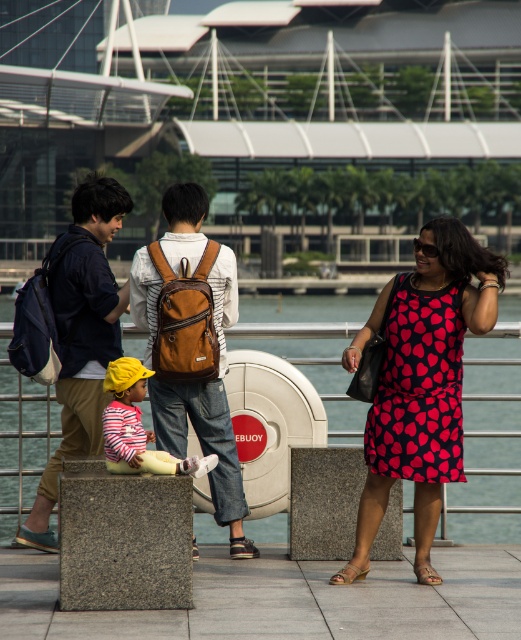
Question: Is printed fabric dress at center above brown leather backpack at center?

Choices:
 (A) no
 (B) yes

Answer: (B)

Question: Which point appears farthest from the camera in this image?

Choices:
 (A) (387, 467)
 (B) (111, 340)

Answer: (B)

Question: Does clear blue water at center appear on the left side of brown leather backpack at center?

Choices:
 (A) yes
 (B) no

Answer: (A)

Question: Estimate the real-world distances between objects in this image. Which object is closer to the printed fabric dress at center?

Choices:
 (A) brown leather backpack at center
 (B) dark red printed dress at center
 (C) dark blue backpack at left

Answer: (B)

Question: Does printed fabric dress at center come behind dark red printed dress at center?

Choices:
 (A) no
 (B) yes

Answer: (A)

Question: Which object is the closest to the printed fabric dress at center?

Choices:
 (A) dark red printed dress at center
 (B) dark blue backpack at left
 (C) clear blue water at center
 (D) brown leather backpack at center

Answer: (A)